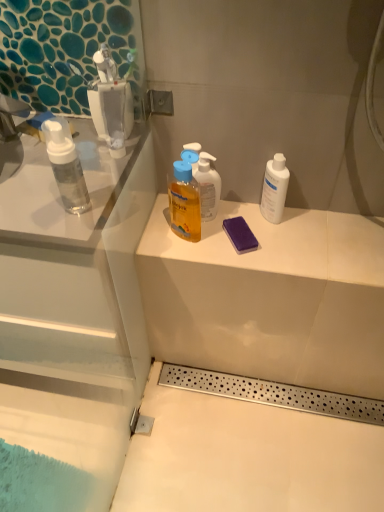
This screenshot has height=512, width=384. I want to click on free space that is to the left of white matte bottle at right, so click(x=208, y=226).